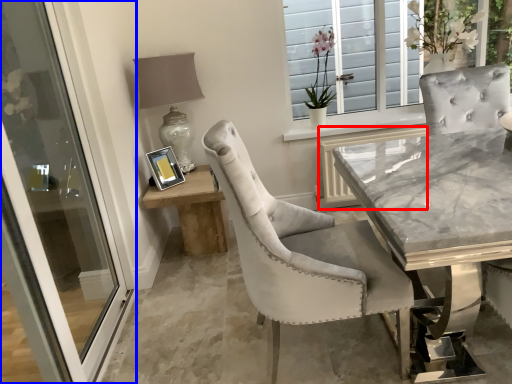
Question: Which of the following is the closest to the observer, shutter (highlighted by a red box) or door (highlighted by a blue box)?

Choices:
 (A) shutter
 (B) door

Answer: (B)